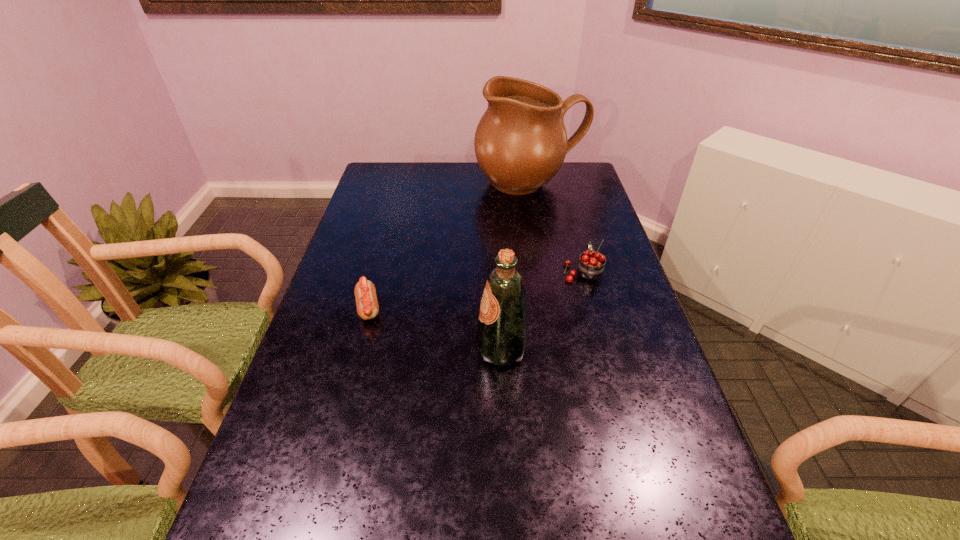
Where is `vacant area situated on the front-facing side of the third shortest object`? This screenshot has width=960, height=540. vacant area situated on the front-facing side of the third shortest object is located at coordinates (448, 349).

You are a GUI agent. You are given a task and a screenshot of the screen. Output one action in this format:
    pyautogui.click(x=<x>, y=<y>)
    Task: Click on the free space located 0.190m on the front-facing side of the third shortest object
    This screenshot has height=540, width=960.
    Given the screenshot: What is the action you would take?
    pyautogui.click(x=399, y=349)

Where is `free space located on the handle side of the third tallest object`? free space located on the handle side of the third tallest object is located at coordinates (564, 200).

This screenshot has height=540, width=960. I want to click on vacant space located on the handle side of the third tallest object, so click(x=565, y=207).

At what (x,y) coordinates should I click in order to perform the action: click on free spot located on the handle side of the third tallest object. Please return your answer as a coordinate pair (x, y). This screenshot has height=540, width=960. Looking at the image, I should click on (565, 207).

Locate an element on the screen. This screenshot has width=960, height=540. blank area located 0.280m on the back of the shortest object is located at coordinates (388, 233).

At what (x,y) coordinates should I click in order to perform the action: click on object present at the far edge. Please return your answer as a coordinate pair (x, y). Looking at the image, I should click on (520, 143).

The height and width of the screenshot is (540, 960). I want to click on object at the left edge, so click(x=365, y=292).

Where is `cream pitcher located in the right edge section of the desktop`? Image resolution: width=960 pixels, height=540 pixels. cream pitcher located in the right edge section of the desktop is located at coordinates (520, 143).

Locate an element on the screen. The image size is (960, 540). cherry at the right edge is located at coordinates (x=591, y=266).